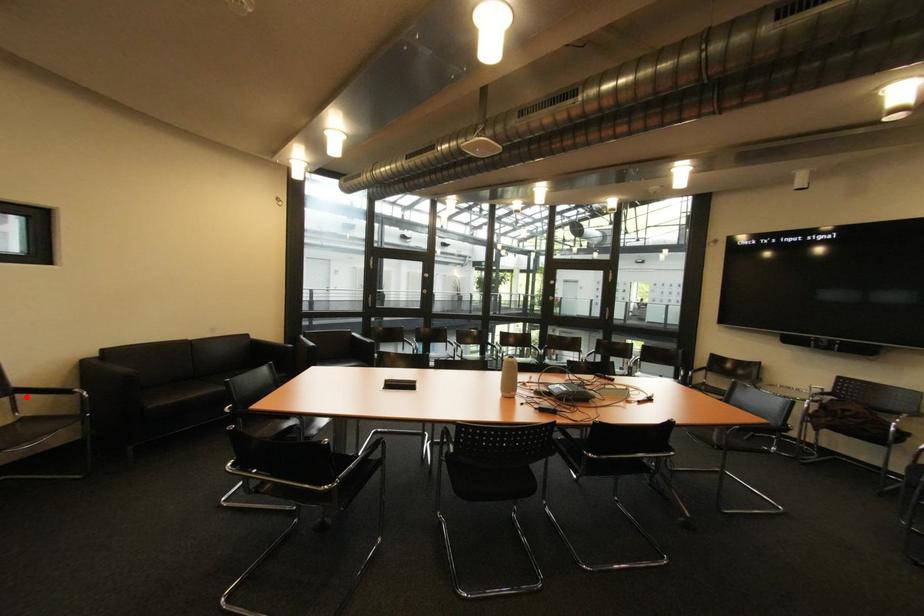
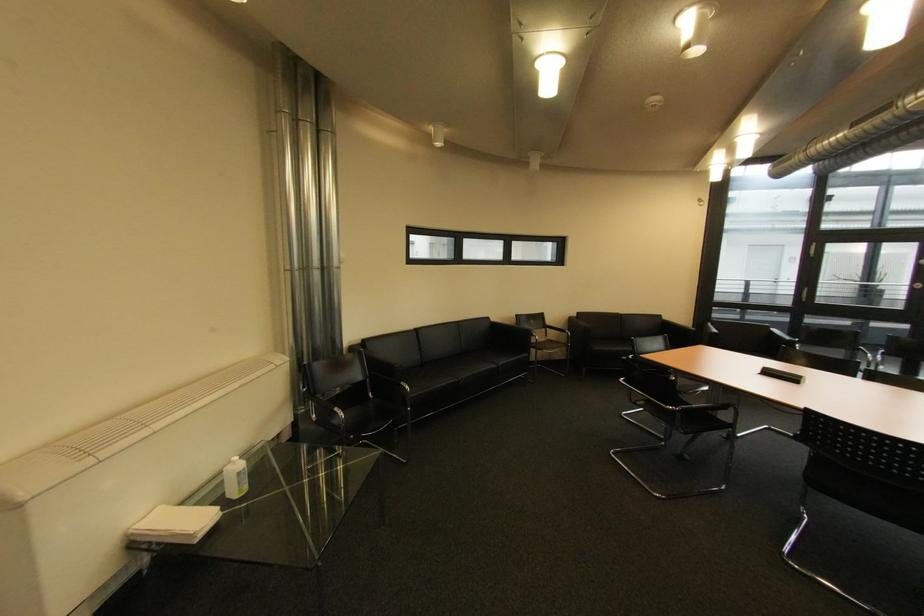
Question: I am providing you with two images of the same scene from different viewpoints. In image1, a red point is highlighted. Considering the same 3D point in image2, which of the following is correct?

Choices:
 (A) It is closer
 (B) It is farther

Answer: (A)